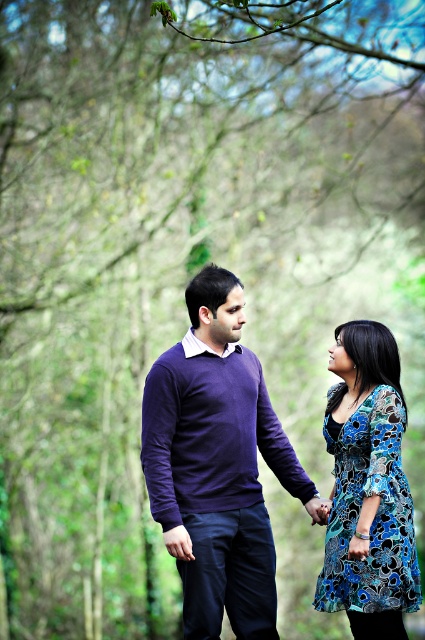
Question: Does purple sweater at center appear under blue floral dress at center?

Choices:
 (A) yes
 (B) no

Answer: (B)

Question: Which point appears farthest from the camera in this image?

Choices:
 (A) (201, 456)
 (B) (374, 609)

Answer: (A)

Question: Which of the following is the closest to the observer?

Choices:
 (A) (255, 632)
 (B) (370, 321)

Answer: (A)

Question: Where is purple sweater at center located in relation to blue floral dress at center in the image?

Choices:
 (A) below
 (B) above

Answer: (B)

Question: Is purple sweater at center behind blue floral dress at center?

Choices:
 (A) yes
 (B) no

Answer: (A)

Question: Which of the following is the closest to the observer?

Choices:
 (A) (384, 557)
 (B) (229, 420)

Answer: (A)